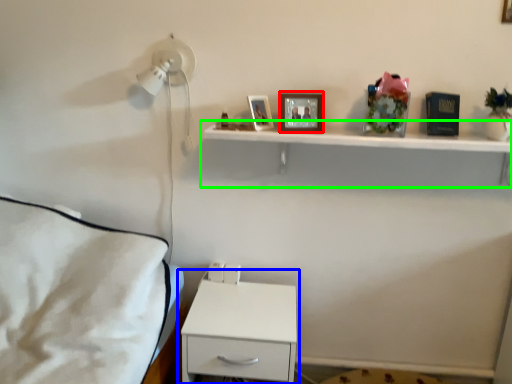
Question: Based on their relative distances, which object is nearer to picture frame (highlighted by a red box)? Choose from nightstand (highlighted by a blue box) and shelf (highlighted by a green box).

Choices:
 (A) nightstand
 (B) shelf

Answer: (B)